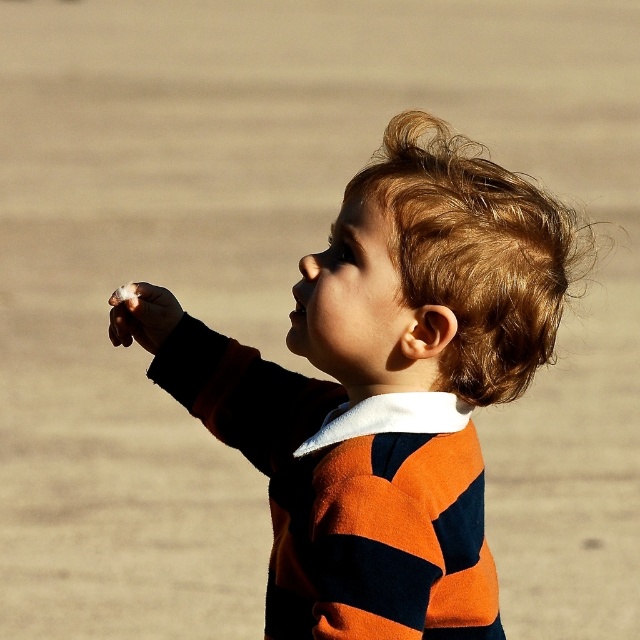
How distant is striped sweater at center from blonde textured hair at upper right?

striped sweater at center is 7.94 inches away from blonde textured hair at upper right.

Which of these two, striped sweater at center or blonde textured hair at upper right, stands shorter?

blonde textured hair at upper right is shorter.

Who is more forward, (403, 330) or (371, 180)?

Point (403, 330) is in front.

Identify the location of striped sweater at center. (390, 388).

Does striped sweater at center have a lesser width compared to white cotton candy at lower left?

No.

Is point (433, 428) behind point (176, 301)?

No.

Where is `striped sweater at center`? striped sweater at center is located at coordinates (390, 388).

Is the position of blonde textured hair at upper right less distant than that of white cotton candy at lower left?

Yes.

Between point (540, 280) and point (168, 330), which one is positioned in front?

Positioned in front is point (540, 280).

Image resolution: width=640 pixels, height=640 pixels. What do you see at coordinates (476, 252) in the screenshot?
I see `blonde textured hair at upper right` at bounding box center [476, 252].

This screenshot has width=640, height=640. In order to click on blonde textured hair at upper right in this screenshot , I will do `click(476, 252)`.